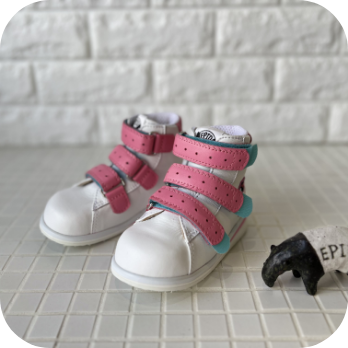
Where is `tile`? tile is located at coordinates (111, 341), (113, 331), (115, 310), (86, 303), (85, 312), (72, 339).